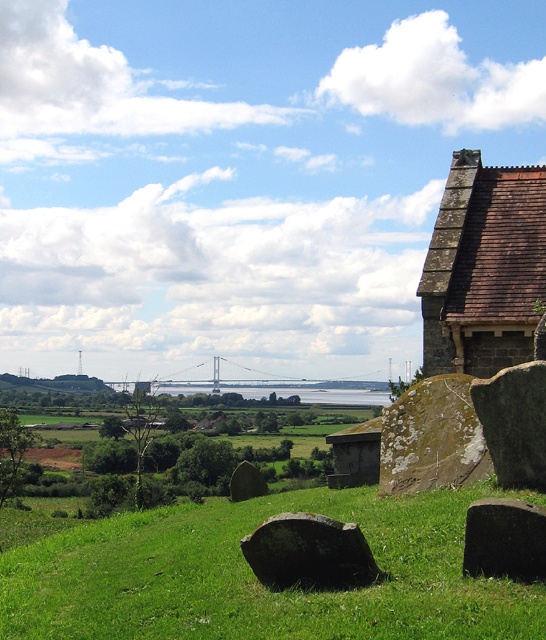
Does green mossy stone at lower right have a lesser width compared to black smooth stone at lower right?

In fact, green mossy stone at lower right might be wider than black smooth stone at lower right.

The height and width of the screenshot is (640, 546). I want to click on green mossy stone at lower right, so click(x=514, y=422).

Where is `green mossy stone at lower right`? This screenshot has height=640, width=546. green mossy stone at lower right is located at coordinates (514, 422).

Is dark gray stone boulder at center closer to the viewer compared to green mossy stone at lower right?

Yes, it is in front of green mossy stone at lower right.

How much distance is there between dark gray stone boulder at center and green mossy stone at lower right?

dark gray stone boulder at center and green mossy stone at lower right are 3.29 meters apart.

At what (x,y) coordinates should I click in order to perform the action: click on dark gray stone boulder at center. Please return your answer as a coordinate pair (x, y). Looking at the image, I should click on (308, 552).

Is white lichen-covered stone at center-right thinner than green mossy stone at lower right?

In fact, white lichen-covered stone at center-right might be wider than green mossy stone at lower right.

The width and height of the screenshot is (546, 640). What are the coordinates of `white lichen-covered stone at center-right` in the screenshot? It's located at (431, 436).

Identify the location of white lichen-covered stone at center-right. (431, 436).